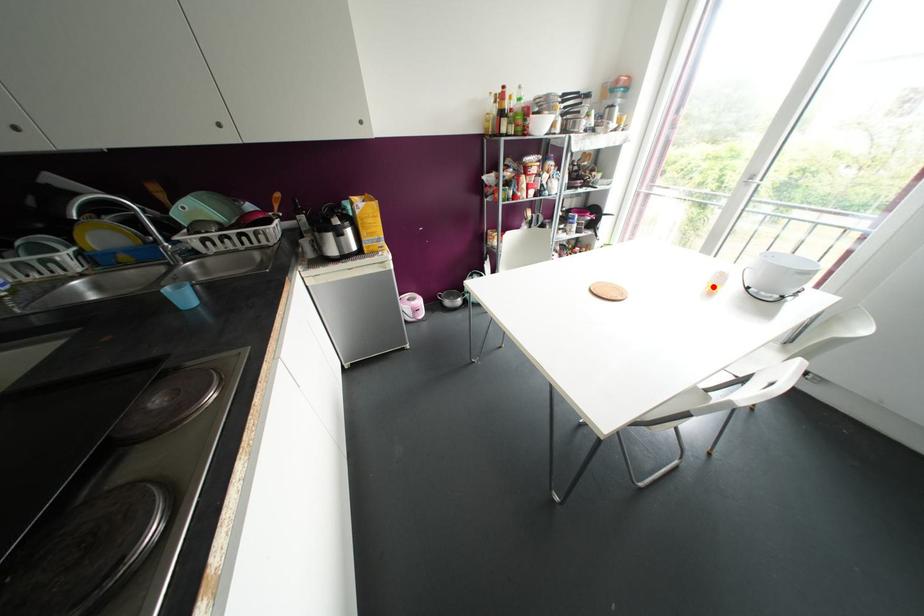
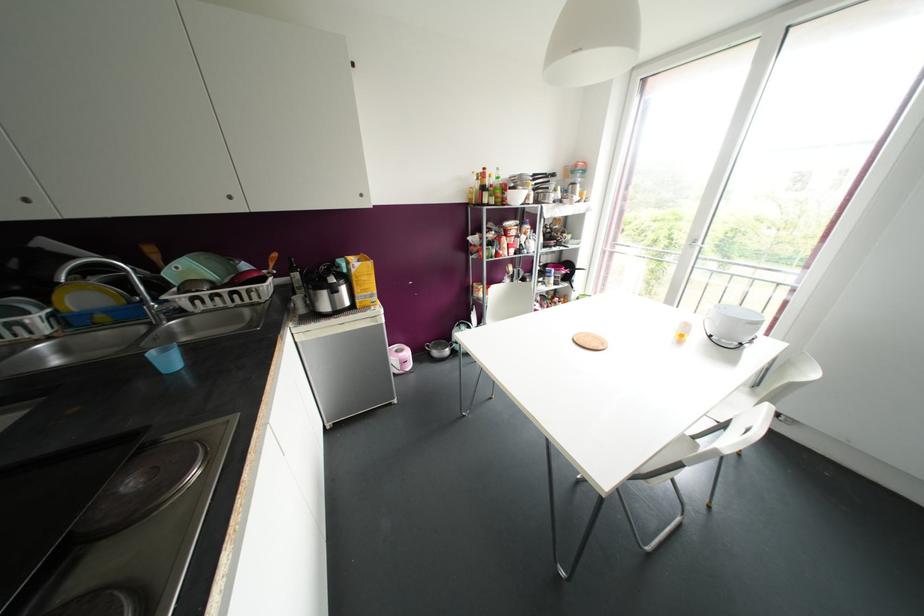
In the second image, find the point that corresponds to the highlighted location in the first image.

(681, 334)